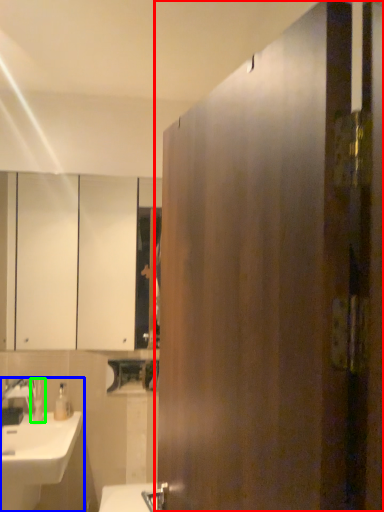
Question: Based on their relative distances, which object is farther from door (highlighted by a red box)? Choose from sink (highlighted by a blue box) and toiletry (highlighted by a green box).

Choices:
 (A) sink
 (B) toiletry

Answer: (B)